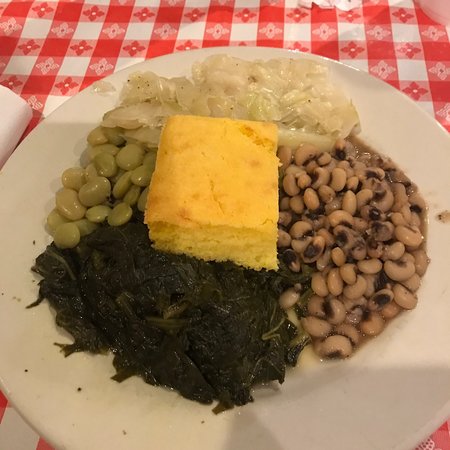
You are a GUI agent. You are given a task and a screenshot of the screen. Output one action in this format:
    pyautogui.click(x=<x>, y=<y>)
    Task: Click on the plate
    This screenshot has height=450, width=450.
    Given the screenshot: What is the action you would take?
    pyautogui.click(x=386, y=379), pyautogui.click(x=387, y=109), pyautogui.click(x=19, y=252), pyautogui.click(x=70, y=381)